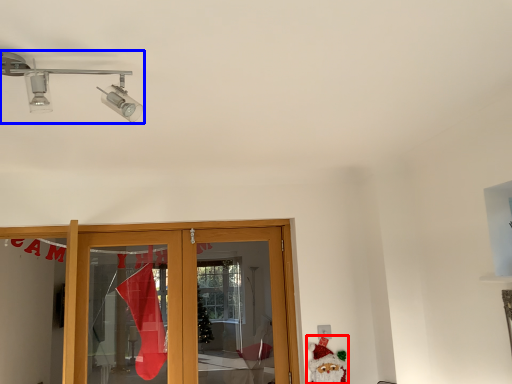
Question: Which of the following is the farthest to the observer, santa claus (highlighted by a red box) or light fixture (highlighted by a blue box)?

Choices:
 (A) santa claus
 (B) light fixture

Answer: (A)